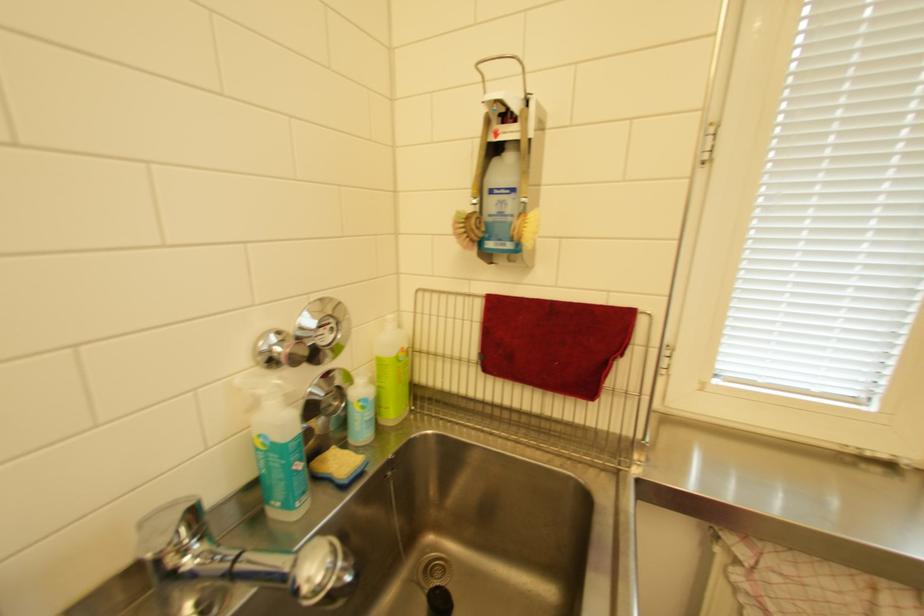
The width and height of the screenshot is (924, 616). What do you see at coordinates (261, 386) in the screenshot?
I see `the dispenser lever` at bounding box center [261, 386].